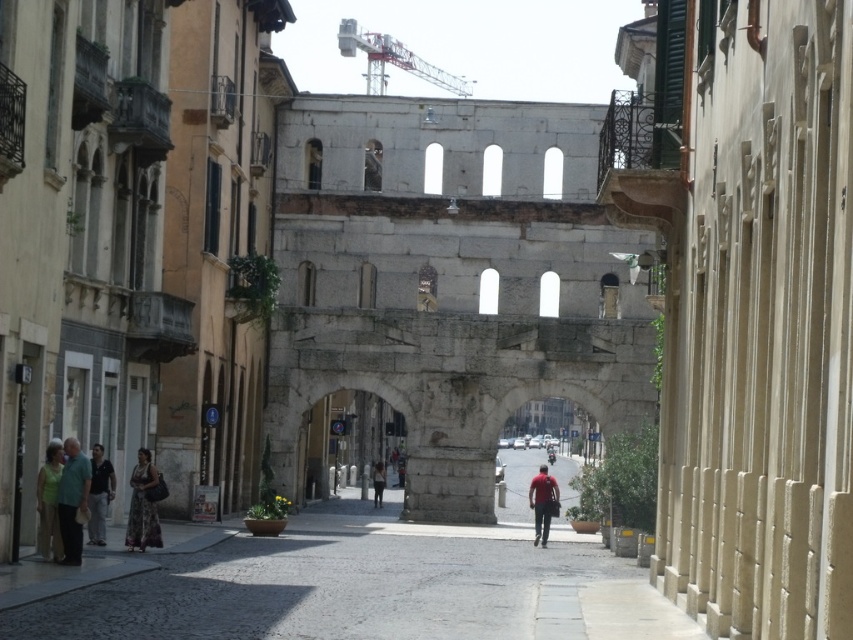
Question: Is green fabric shirt at lower left positioned before dark brown leather jacket at center?

Choices:
 (A) no
 (B) yes

Answer: (B)

Question: Which object is farther from the camera taking this photo?

Choices:
 (A) matte red shirt at center
 (B) floral dress at lower left
 (C) dark gray fabric pants at lower left

Answer: (A)

Question: Estimate the real-world distances between objects in this image. Which object is closer to the dark gray fabric pants at lower left?

Choices:
 (A) dark brown leather jacket at center
 (B) cobblestone pavement at center

Answer: (B)

Question: Considering the relative positions of green fabric shirt at lower left and dark brown leather jacket at center in the image provided, where is green fabric shirt at lower left located with respect to dark brown leather jacket at center?

Choices:
 (A) left
 (B) right

Answer: (A)

Question: Which point is farther to the camera?

Choices:
 (A) green fabric shirt at lower left
 (B) dark brown leather jacket at center
 (C) cobblestone pavement at center

Answer: (B)

Question: Does cobblestone pavement at center have a greater width compared to dark gray fabric pants at lower left?

Choices:
 (A) yes
 (B) no

Answer: (A)